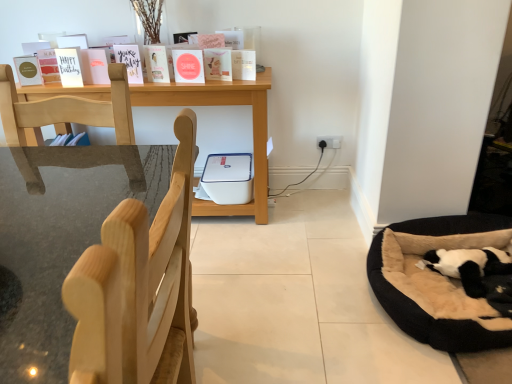
Locate an element on the screen. This screenshot has width=512, height=384. free space to the left of white matte paperback book at upper center, the 1th paperback book viewed from the right is located at coordinates (219, 79).